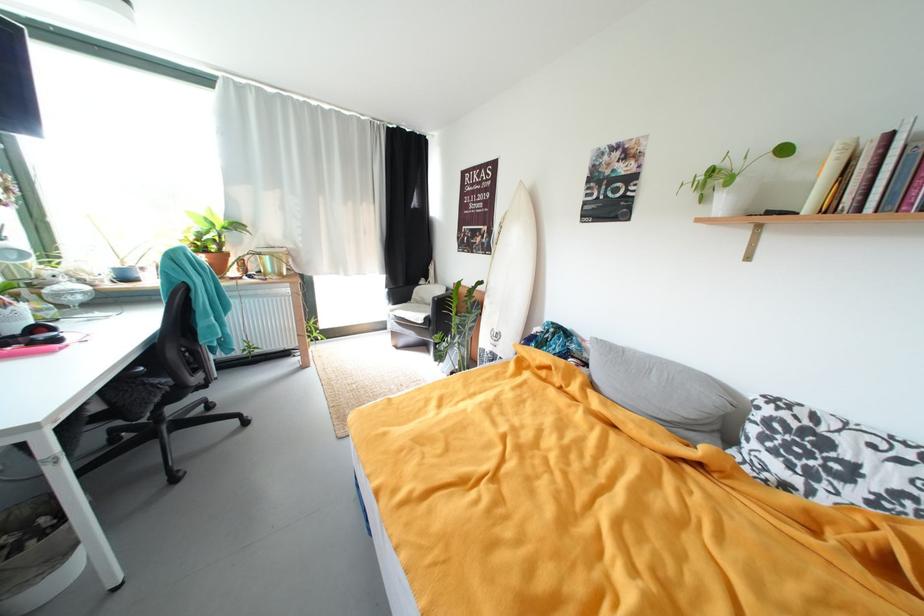
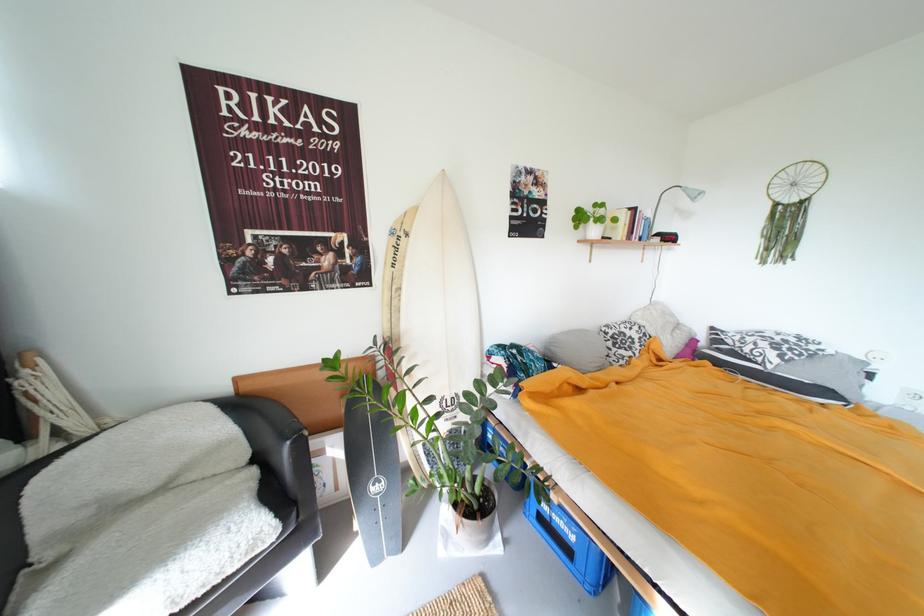
Where in the second image is the point corresponding to (x=766, y=410) from the first image?

(614, 334)